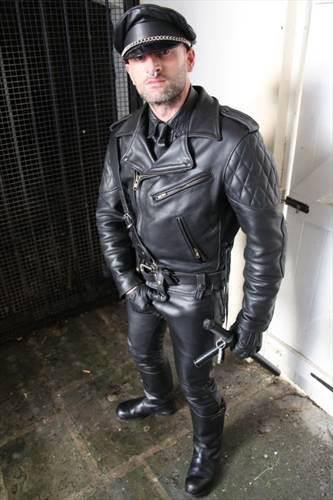
At what (x,y) coordinates should I click in order to perform the action: click on stone floor. Please return your answer as a coordinate pair (x, y). The height and width of the screenshot is (500, 333). Looking at the image, I should click on (280, 434).